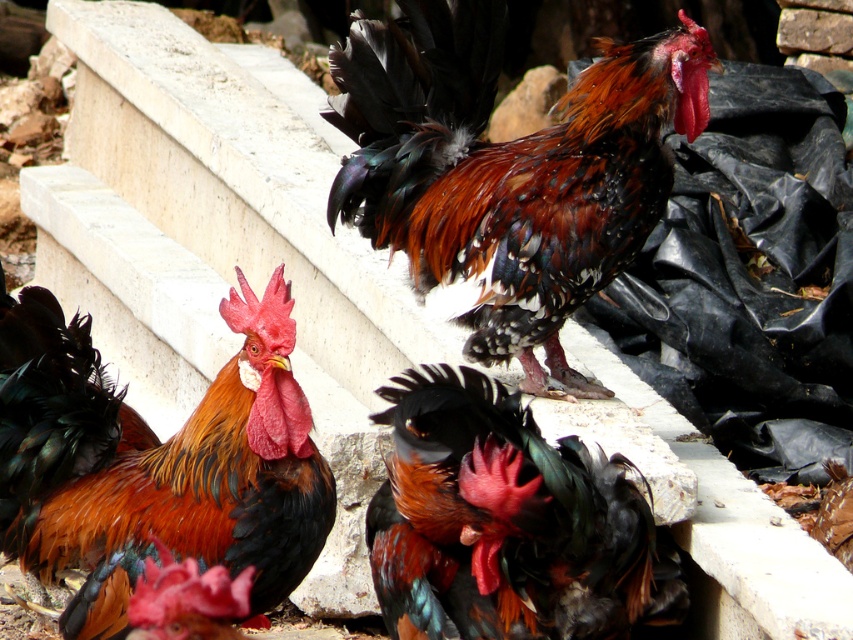
This screenshot has width=853, height=640. What do you see at coordinates (155, 461) in the screenshot? I see `shiny orange feathers at center` at bounding box center [155, 461].

Is shiny orange feathers at center smaller than shiny black feathers at center?

Yes.

Which is behind, point (74, 627) or point (531, 445)?

Point (74, 627)

Find the location of a particular element. Image resolution: width=853 pixels, height=640 pixels. shiny orange feathers at center is located at coordinates (155, 461).

Does shiny multicolored rooster at center appear on the left side of shiny black feathers at center?

No, shiny multicolored rooster at center is not to the left of shiny black feathers at center.

Can you confirm if shiny multicolored rooster at center is bigger than shiny black feathers at center?

Indeed, shiny multicolored rooster at center has a larger size compared to shiny black feathers at center.

Where is `shiny multicolored rooster at center`? shiny multicolored rooster at center is located at coordinates (508, 170).

This screenshot has width=853, height=640. In order to click on shiny multicolored rooster at center in this screenshot , I will do `click(508, 170)`.

Is shiny multicolored rooster at center above shiny orange feathers at center?

Correct, shiny multicolored rooster at center is located above shiny orange feathers at center.

Does shiny multicolored rooster at center appear on the right side of shiny orange feathers at center?

Indeed, shiny multicolored rooster at center is positioned on the right side of shiny orange feathers at center.

Who is more distant from viewer, (x=393, y=33) or (x=19, y=323)?

Positioned behind is point (x=393, y=33).

The width and height of the screenshot is (853, 640). I want to click on shiny multicolored rooster at center, so click(508, 170).